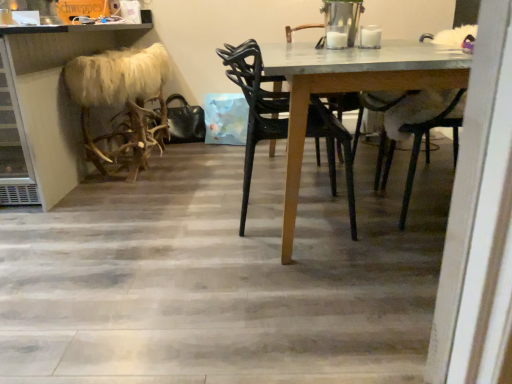
Question: From a real-world perspective, is faux fur stool at left positioned above or below black plastic chair at center?

Choices:
 (A) above
 (B) below

Answer: (A)

Question: Considering the positions of faux fur stool at left and black plastic chair at center in the image, is faux fur stool at left wider or thinner than black plastic chair at center?

Choices:
 (A) thin
 (B) wide

Answer: (B)

Question: Which is nearer to the furry white antlers at left?

Choices:
 (A) white fur at upper right
 (B) faux fur stool at left
 (C) wooden table at center
 (D) black plastic chair at center

Answer: (B)

Question: Which object is the farthest from the white fur at upper right?

Choices:
 (A) black plastic chair at center
 (B) wooden table at center
 (C) faux fur stool at left
 (D) furry white antlers at left

Answer: (C)